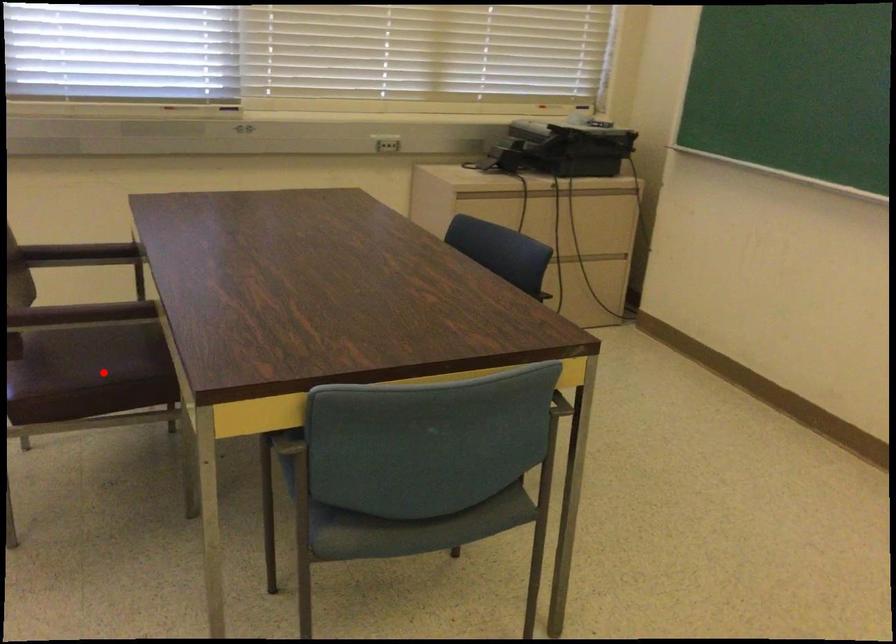
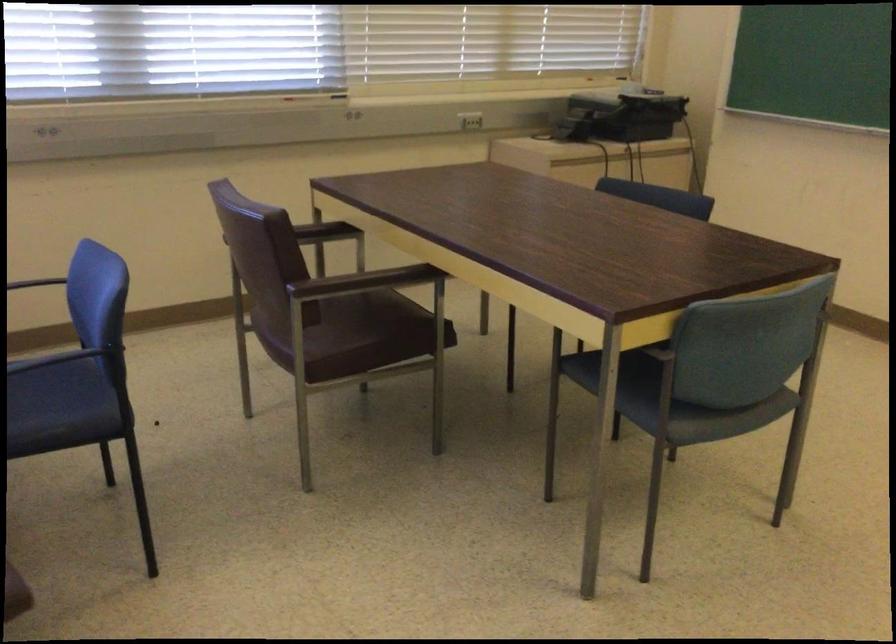
Where in the second image is the point corresponding to the highlighted location from the first image?

(371, 330)